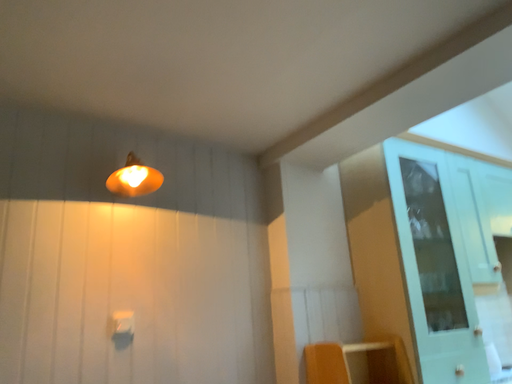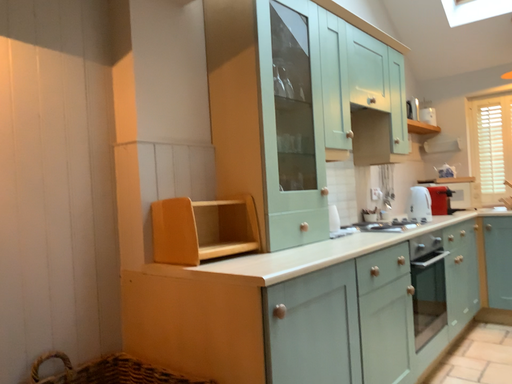
Question: How did the camera likely rotate when shooting the video?

Choices:
 (A) rotated downward
 (B) rotated upward

Answer: (A)